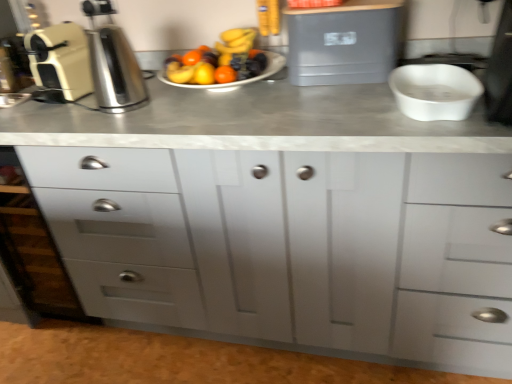
Question: Is satin silver coffee machine at left smaller than gray plastic container at upper center, the 1th appliance positioned from the right?

Choices:
 (A) no
 (B) yes

Answer: (B)

Question: Is satin silver coffee machine at left not within gray plastic container at upper center, the second appliance in the left-to-right sequence?

Choices:
 (A) yes
 (B) no

Answer: (A)

Question: Is satin silver coffee machine at left surrounding gray plastic container at upper center, the 1th appliance positioned from the right?

Choices:
 (A) no
 (B) yes

Answer: (A)

Question: Is satin silver coffee machine at left to the right of gray plastic container at upper center, the second appliance in the left-to-right sequence, from the viewer's perspective?

Choices:
 (A) yes
 (B) no

Answer: (B)

Question: From the image's perspective, does satin silver coffee machine at left appear higher than gray plastic container at upper center, the 1th appliance positioned from the right?

Choices:
 (A) yes
 (B) no

Answer: (B)

Question: Does satin silver coffee machine at left have a greater height compared to gray plastic container at upper center, the 1th appliance positioned from the right?

Choices:
 (A) yes
 (B) no

Answer: (A)

Question: From the image's perspective, is white matte chest of drawers at center above gray plastic container at upper center, the 1th appliance positioned from the right?

Choices:
 (A) no
 (B) yes

Answer: (A)

Question: From a real-world perspective, is white matte chest of drawers at center under gray plastic container at upper center, the 1th appliance positioned from the right?

Choices:
 (A) no
 (B) yes

Answer: (B)

Question: Considering the relative positions of white matte chest of drawers at center and gray plastic container at upper center, the second appliance in the left-to-right sequence, in the image provided, is white matte chest of drawers at center in front of gray plastic container at upper center, the second appliance in the left-to-right sequence,?

Choices:
 (A) no
 (B) yes

Answer: (B)

Question: Is white matte chest of drawers at center aimed at gray plastic container at upper center, the 1th appliance positioned from the right?

Choices:
 (A) no
 (B) yes

Answer: (A)

Question: Is white matte chest of drawers at center taller than gray plastic container at upper center, the second appliance in the left-to-right sequence?

Choices:
 (A) yes
 (B) no

Answer: (A)

Question: Considering the relative sizes of white matte chest of drawers at center and gray plastic container at upper center, the 1th appliance positioned from the right, in the image provided, is white matte chest of drawers at center wider than gray plastic container at upper center, the 1th appliance positioned from the right,?

Choices:
 (A) no
 (B) yes

Answer: (B)

Question: From a real-world perspective, is satin silver coffee machine at left over cream matte coffee machine at left, marked as the 1th appliance in a left-to-right arrangement?

Choices:
 (A) yes
 (B) no

Answer: (B)